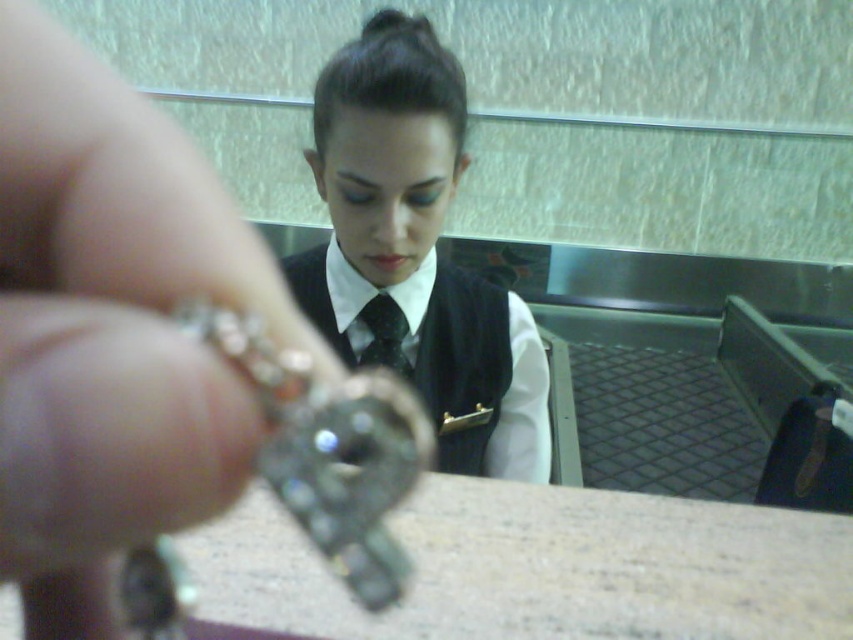
Question: Among these objects, which one is nearest to the camera?

Choices:
 (A) black satin vest at center
 (B) silver metallic ring at upper left

Answer: (B)

Question: Which object is closer to the camera taking this photo?

Choices:
 (A) silver metallic ring at upper left
 (B) black satin vest at center

Answer: (A)

Question: Is silver metallic ring at upper left bigger than black satin vest at center?

Choices:
 (A) yes
 (B) no

Answer: (B)

Question: Does silver metallic ring at upper left have a smaller size compared to black satin vest at center?

Choices:
 (A) yes
 (B) no

Answer: (A)

Question: Is silver metallic ring at upper left below black satin vest at center?

Choices:
 (A) yes
 (B) no

Answer: (B)